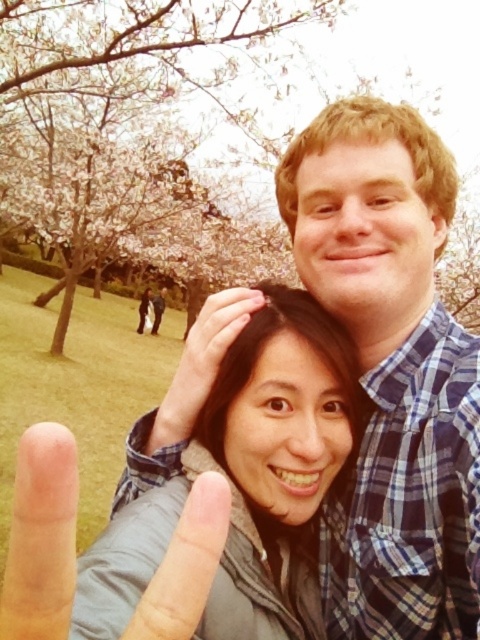
Question: Among these objects, which one is farthest from the camera?

Choices:
 (A) matte skin at center
 (B) blue plaid shirt at center
 (C) cherry blossom tree at upper left
 (D) matte gray jacket at center

Answer: (C)

Question: Is blue plaid shirt at center closer to camera compared to matte skin at center?

Choices:
 (A) yes
 (B) no

Answer: (A)

Question: Is blue plaid shirt at center positioned in front of matte skin at center?

Choices:
 (A) no
 (B) yes

Answer: (B)

Question: Among these objects, which one is farthest from the camera?

Choices:
 (A) matte skin at center
 (B) matte gray jacket at center
 (C) blue plaid shirt at center

Answer: (A)

Question: Does matte gray jacket at center appear over matte skin at center?

Choices:
 (A) no
 (B) yes

Answer: (A)

Question: Which object is closer to the camera taking this photo?

Choices:
 (A) matte skin at center
 (B) matte gray jacket at center

Answer: (B)